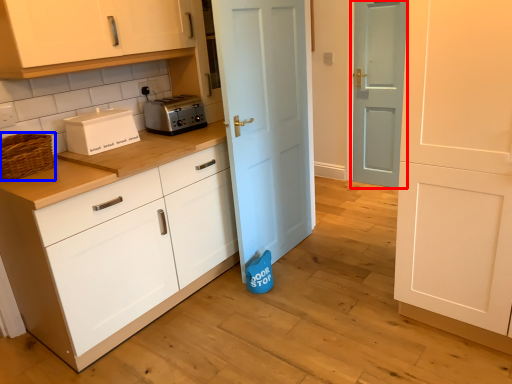
Question: Among these objects, which one is farthest to the camera, door (highlighted by a red box) or basket (highlighted by a blue box)?

Choices:
 (A) door
 (B) basket

Answer: (A)